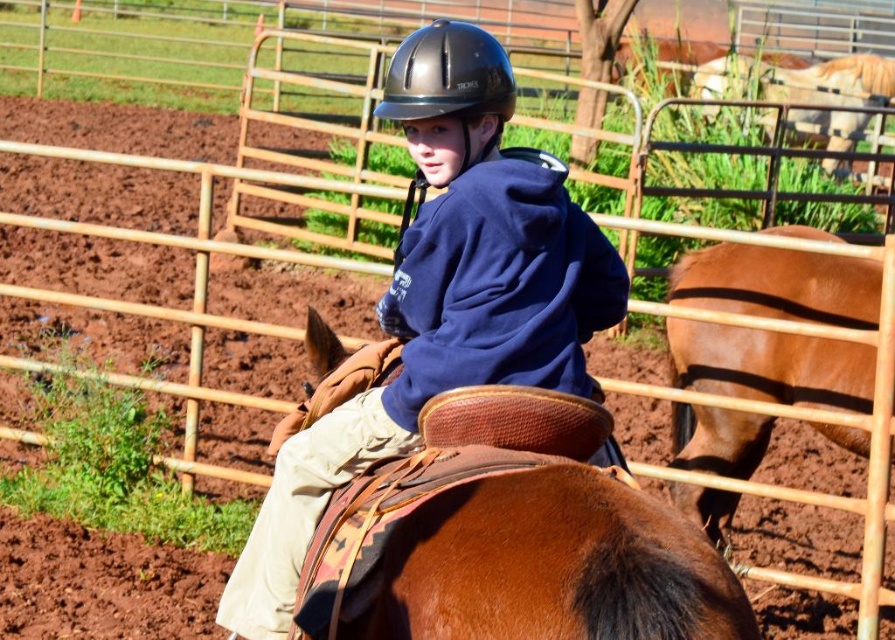
You are a photographer positioned behind the rider and want to capture a clear shot of both the matte black helmet at center and the glossy black helmet at center. Which helmet will appear larger in your photo?

The matte black helmet at center will appear larger in the photo because it is closer to the viewer than the glossy black helmet at center.

You are designing a storage rack for equestrian gear. The rack has two compartments. The first compartment is designed to hold the brown leather saddle at center, and the second compartment is for the glossy black helmet at center. Based on the image, which compartment should be larger?

The brown leather saddle at center is larger in size than the glossy black helmet at center, so the first compartment for the saddle should be larger.